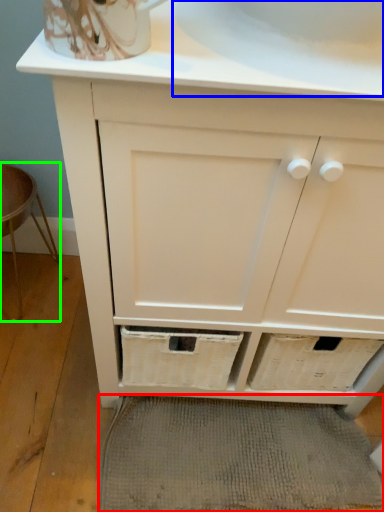
Question: Estimate the real-world distances between objects in this image. Which object is farther from bath mat (highlighted by a red box), sink (highlighted by a blue box) or bar stool (highlighted by a green box)?

Choices:
 (A) sink
 (B) bar stool

Answer: (A)